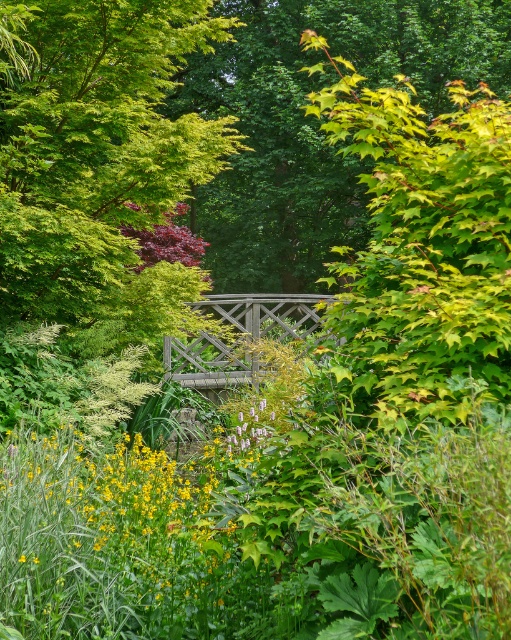
In the scene shown: You are a gardener standing in the garden. You want to water the green matte flower at center but the green leafy tree at upper left is blocking your path. Can you move around the tree to reach the flower?

The green matte flower at center is behind the green leafy tree at upper left, so you can move around the tree to reach the flower since it is positioned behind it.

You are a photographer standing at the camera position in the garden scene. You want to take a photo of the green leafy tree at center. If you move forward 5 meters, will the tree appear larger in your photo?

The green leafy tree at center is currently 22.10 meters away. Moving forward 5 meters would reduce the distance to 17.10 meters. Since objects appear larger in a photo as you get closer, the tree would appear larger in the photo after moving forward.

You are a gardener planning to plant a new tree in this garden. You notice the green leafy tree at upper left and the green leafy tree at center. Which tree takes up more space in the garden?

The green leafy tree at center takes up more space in the garden than the green leafy tree at upper left.